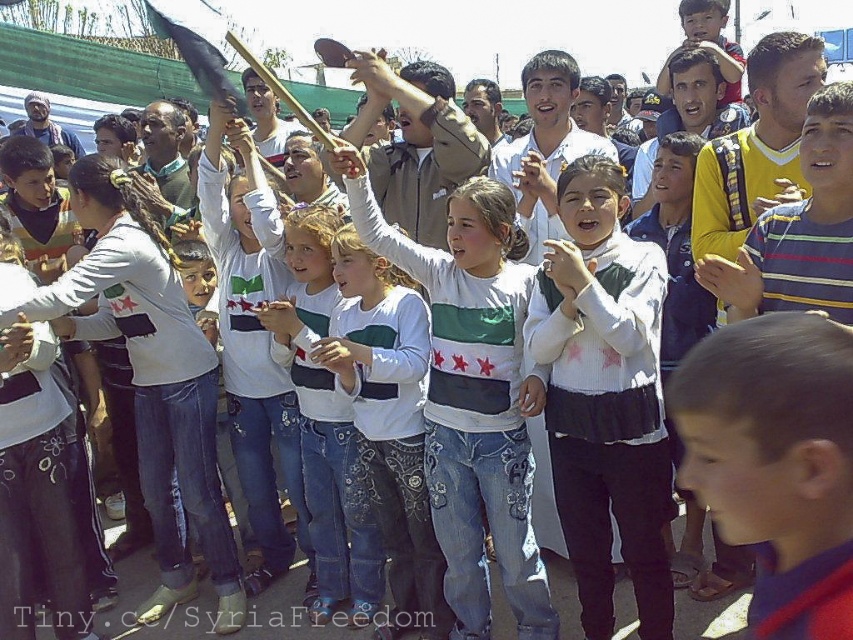
Locate an element on the screen. The width and height of the screenshot is (853, 640). white knit sweater at center is located at coordinates (604, 396).

Can you confirm if white knit sweater at center is positioned to the right of white cotton shirt at center?

Correct, you'll find white knit sweater at center to the right of white cotton shirt at center.

Locate an element on the screen. white knit sweater at center is located at coordinates pyautogui.click(x=604, y=396).

Does white cotton shirt at center appear under white denim jeans at center?

No, white cotton shirt at center is not below white denim jeans at center.

Which is in front, point (495, 483) or point (404, 280)?

Point (495, 483) is more forward.

This screenshot has height=640, width=853. Find the location of `white cotton shirt at center`. white cotton shirt at center is located at coordinates (473, 397).

Which of these two, white knit sweater at center or white denim jeans at center, stands taller?

white knit sweater at center

Between white knit sweater at center and white denim jeans at center, which one appears on the left side from the viewer's perspective?

Positioned to the left is white denim jeans at center.

Is point (621, 196) closer to camera compared to point (422, 509)?

Yes, point (621, 196) is in front of point (422, 509).

Identify the location of white knit sweater at center. The height and width of the screenshot is (640, 853). (604, 396).